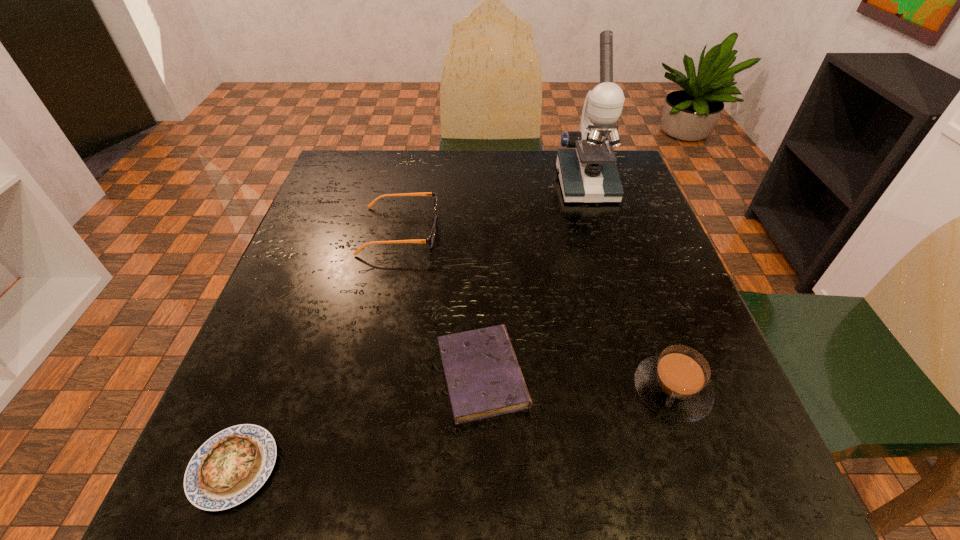
Where is `the farthest object`? The height and width of the screenshot is (540, 960). the farthest object is located at coordinates (587, 170).

This screenshot has height=540, width=960. Find the location of `microscope`. microscope is located at coordinates (587, 170).

I want to click on cappuccino, so click(675, 384).

The height and width of the screenshot is (540, 960). In order to click on the fourth nearest object in this screenshot , I will do `click(430, 240)`.

Find the location of `spectacles`. spectacles is located at coordinates (430, 240).

Locate an element on the screen. the third object from right to left is located at coordinates click(x=483, y=376).

Image resolution: width=960 pixels, height=540 pixels. I want to click on the leftmost object, so click(x=231, y=466).

The image size is (960, 540). What are the coordinates of `quiche` in the screenshot? It's located at (231, 466).

Identify the location of vacant space located at the eyepiece of the microscope. (599, 228).

Locate an element on the screen. The width and height of the screenshot is (960, 540). free space located 0.320m on the back of the cappuccino is located at coordinates (619, 239).